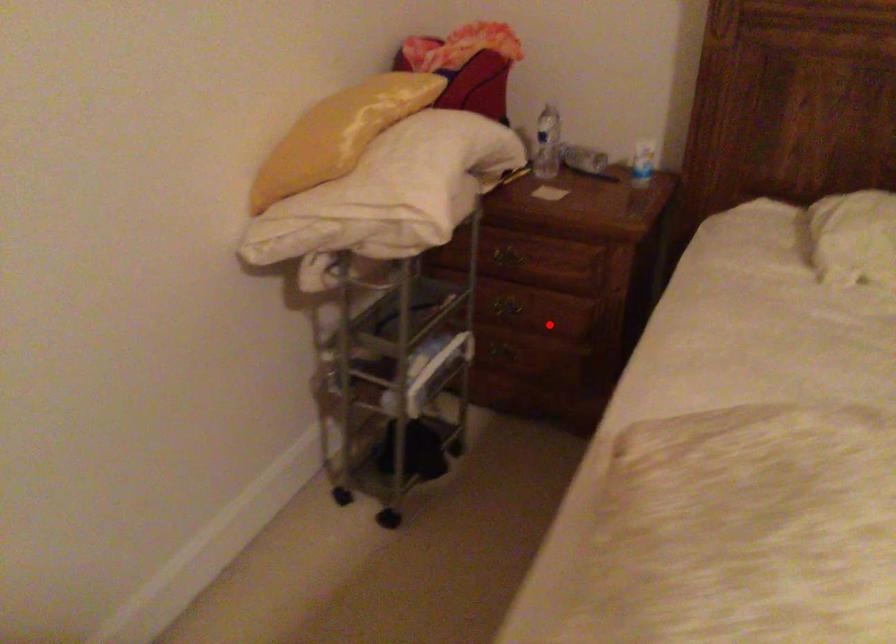
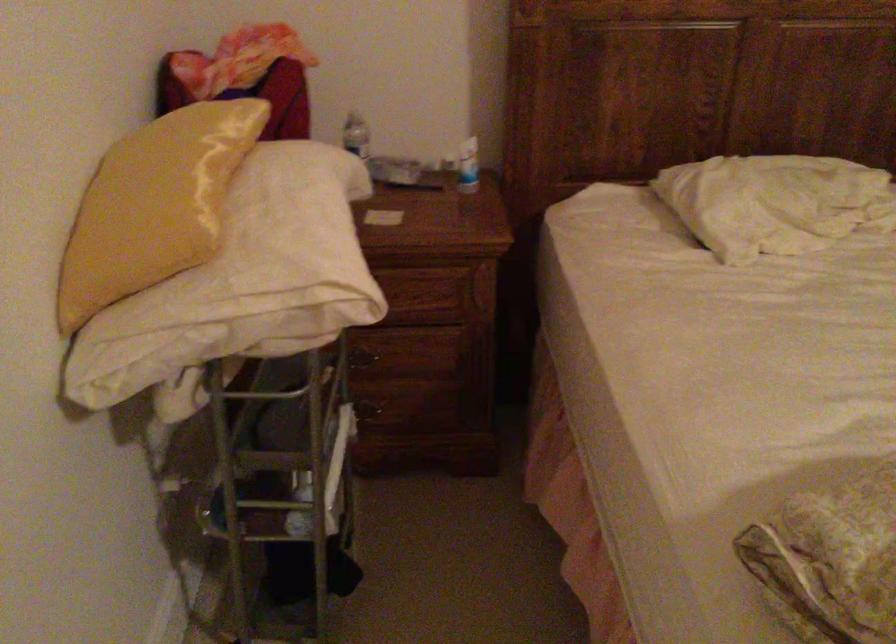
In the second image, find the point that corresponds to the highlighted location in the first image.

(412, 365)